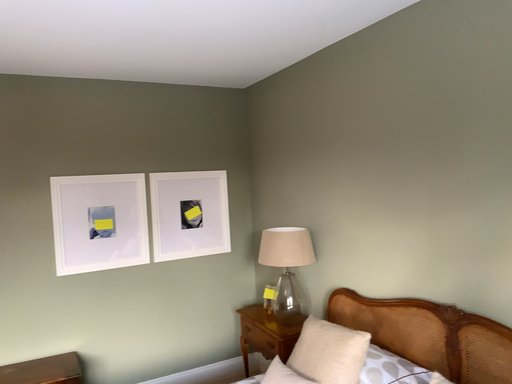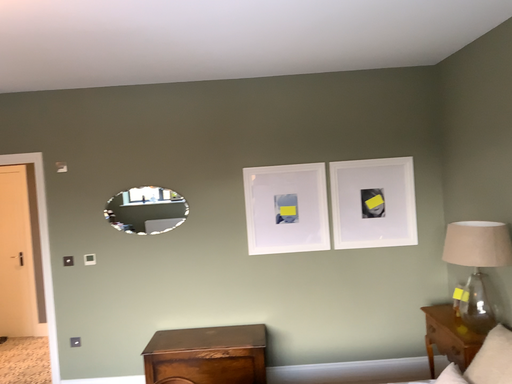
Question: Which way did the camera rotate in the video?

Choices:
 (A) rotated left
 (B) rotated right

Answer: (A)